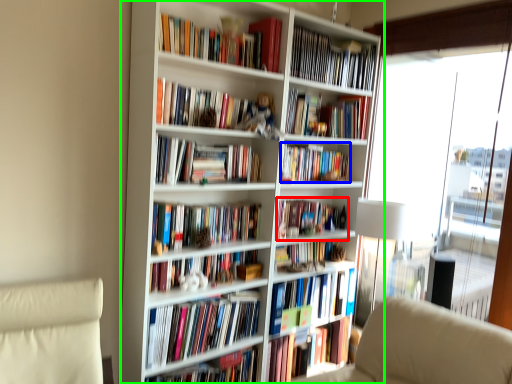
Question: Estimate the real-world distances between objects in this image. Which object is closer to book (highlighted by a red box), book (highlighted by a blue box) or bookcase (highlighted by a green box)?

Choices:
 (A) book
 (B) bookcase

Answer: (A)